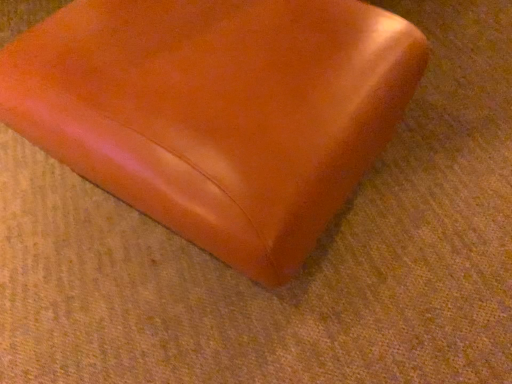
The width and height of the screenshot is (512, 384). I want to click on vacant space to the right of satin orange cushion at center, so click(x=448, y=132).